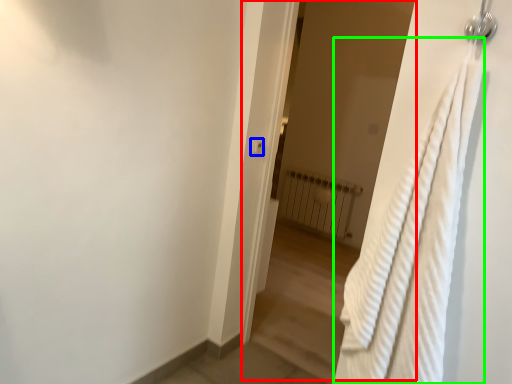
Question: Which object is positioned closest to screen door (highlighted by a red box)? Select from light switch (highlighted by a blue box) and bath towel (highlighted by a green box).

Choices:
 (A) light switch
 (B) bath towel

Answer: (A)